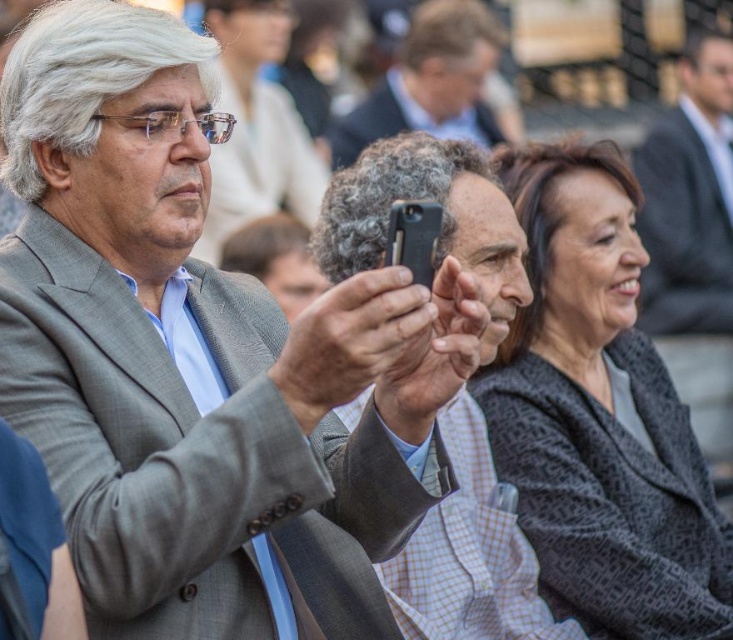
You are standing in front of the group and want to determine which of the two points, point [556,180] or point [405,54], is nearer to you. Based on the scene, which point is closer?

Point [556,180] is closer to the camera than point [405,54], so it is the nearer point.

Looking at this image, you are a photographer trying to capture a candid shot of the scene. You notice the matte black phone at center and the gray wool suit at center. Which object is positioned closer to your camera lens?

The matte black phone at center is closer to the viewer than the gray wool suit at center, so the phone would be closer to the camera lens.